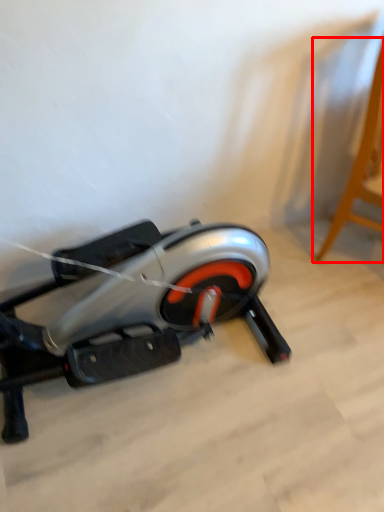
Question: Considering the relative positions of furniture (annotated by the red box) and stationary bicycle in the image provided, where is furniture (annotated by the red box) located with respect to the staircase?

Choices:
 (A) right
 (B) left

Answer: (A)